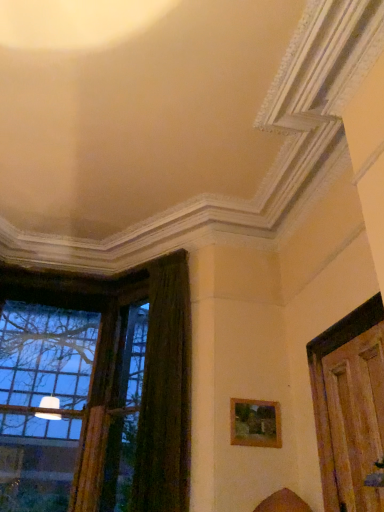
Describe the element at coordinates (255, 423) in the screenshot. I see `wooden picture frame at lower right` at that location.

You are a GUI agent. You are given a task and a screenshot of the screen. Output one action in this format:
    pyautogui.click(x=<x>, y=<y>)
    Task: Click on the wooden picture frame at lower right
    
    Given the screenshot: What is the action you would take?
    pyautogui.click(x=255, y=423)

Where is `wooden door at right`? This screenshot has width=384, height=512. wooden door at right is located at coordinates (353, 422).

Is wooden door at right positioned before clear glass window at left?

Yes, it is.

Who is smaller, wooden door at right or clear glass window at left?

Smaller between the two is wooden door at right.

Are wooden door at right and clear glass window at left making contact?

No, wooden door at right is not beside clear glass window at left.

Is point (345, 462) farther from camera compared to point (158, 461)?

No, (345, 462) is closer to viewer.

Is clear glass window at left inside or outside of dark green velvet curtain at left?

clear glass window at left lies outside dark green velvet curtain at left.

Considering the sizes of clear glass window at left and dark green velvet curtain at left in the image, is clear glass window at left bigger or smaller than dark green velvet curtain at left?

clear glass window at left is bigger than dark green velvet curtain at left.

Can you confirm if clear glass window at left is taller than dark green velvet curtain at left?

Yes.

What's the angular difference between dark green velvet curtain at left and wooden picture frame at lower right's facing directions?

50.4 degrees.

Is dark green velvet curtain at left at the left side of wooden picture frame at lower right?

Yes, dark green velvet curtain at left is to the left of wooden picture frame at lower right.

Is dark green velvet curtain at left directly adjacent to wooden picture frame at lower right?

No, dark green velvet curtain at left is not making contact with wooden picture frame at lower right.

Is dark green velvet curtain at left bigger than wooden picture frame at lower right?

Indeed, dark green velvet curtain at left has a larger size compared to wooden picture frame at lower right.

In terms of width, does dark green velvet curtain at left look wider or thinner when compared to wooden door at right?

Clearly, dark green velvet curtain at left has more width compared to wooden door at right.

Between point (182, 412) and point (361, 479), which one is positioned behind?

The point (182, 412) is more distant.

Is dark green velvet curtain at left far from wooden door at right?

dark green velvet curtain at left is positioned a significant distance from wooden door at right.

Find the location of a particular element. Image resolution: width=384 pixels, height=512 pixels. door that is below the dark green velvet curtain at left (from the image's perspective) is located at coordinates (353, 422).

Which of these two, clear glass window at left or wooden picture frame at lower right, is smaller?

With smaller size is wooden picture frame at lower right.

Is clear glass window at left taller or shorter than wooden picture frame at lower right?

clear glass window at left is taller than wooden picture frame at lower right.

Can you see clear glass window at left touching wooden picture frame at lower right?

No.

Is clear glass window at left positioned in front of wooden picture frame at lower right?

No, the depth of clear glass window at left is greater than that of wooden picture frame at lower right.

Can you tell me how much wooden picture frame at lower right and dark green velvet curtain at left differ in facing direction?

They differ by 50.4 degrees in their facing directions.

Is wooden picture frame at lower right behind dark green velvet curtain at left?

Yes, wooden picture frame at lower right is further from the viewer.

Considering the sizes of objects wooden picture frame at lower right and dark green velvet curtain at left in the image provided, who is thinner, wooden picture frame at lower right or dark green velvet curtain at left?

With smaller width is wooden picture frame at lower right.

The image size is (384, 512). What are the coordinates of `curtain lying in front of the wooden picture frame at lower right` in the screenshot? It's located at (165, 393).

Does dark green velvet curtain at left contain clear glass window at left?

No, clear glass window at left is not inside dark green velvet curtain at left.

Can you confirm if dark green velvet curtain at left is positioned to the right of clear glass window at left?

Indeed, dark green velvet curtain at left is positioned on the right side of clear glass window at left.

Does dark green velvet curtain at left have a greater height compared to clear glass window at left?

No.

The image size is (384, 512). Identify the location of window above the wooden door at right (from a real-world perspective). (95, 391).

Identify the location of window behind the dark green velvet curtain at left. The width and height of the screenshot is (384, 512). (95, 391).

Considering their positions, is clear glass window at left positioned further to wooden door at right than dark green velvet curtain at left?

The object further to wooden door at right is clear glass window at left.

Estimate the real-world distances between objects in this image. Which object is closer to dark green velvet curtain at left, wooden door at right or clear glass window at left?

clear glass window at left is closer to dark green velvet curtain at left.

Based on their spatial positions, is wooden picture frame at lower right or wooden door at right further from clear glass window at left?

Among the two, wooden door at right is located further to clear glass window at left.

Estimate the real-world distances between objects in this image. Which object is closer to dark green velvet curtain at left, wooden door at right or wooden picture frame at lower right?

Among the two, wooden picture frame at lower right is located nearer to dark green velvet curtain at left.

From the image, which object appears to be farther from clear glass window at left, wooden door at right or dark green velvet curtain at left?

Based on the image, wooden door at right appears to be further to clear glass window at left.

Looking at the image, which one is located closer to clear glass window at left, dark green velvet curtain at left or wooden door at right?

dark green velvet curtain at left is closer to clear glass window at left.

Considering their positions, is clear glass window at left positioned closer to wooden door at right than wooden picture frame at lower right?

wooden picture frame at lower right lies closer to wooden door at right than the other object.

From the image, which object appears to be farther from wooden picture frame at lower right, clear glass window at left or dark green velvet curtain at left?

Based on the image, clear glass window at left appears to be further to wooden picture frame at lower right.

This screenshot has width=384, height=512. Find the location of `picture frame between clear glass window at left and wooden door at right from left to right`. picture frame between clear glass window at left and wooden door at right from left to right is located at coordinates (255, 423).

Where is `curtain situated between clear glass window at left and wooden picture frame at lower right from left to right`? The height and width of the screenshot is (512, 384). curtain situated between clear glass window at left and wooden picture frame at lower right from left to right is located at coordinates (165, 393).

Image resolution: width=384 pixels, height=512 pixels. In order to click on curtain located between clear glass window at left and wooden door at right in the left-right direction in this screenshot , I will do `click(165, 393)`.

This screenshot has width=384, height=512. Identify the location of picture frame located between dark green velvet curtain at left and wooden door at right in the left-right direction. (255, 423).